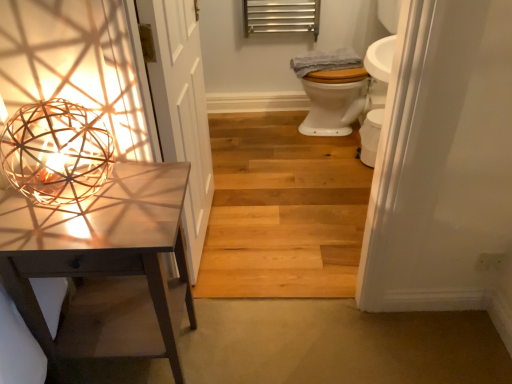
Question: Would you say woven wood sphere at left is to the left or to the right of natural wood floor at center in the picture?

Choices:
 (A) left
 (B) right

Answer: (A)

Question: In terms of width, does woven wood sphere at left look wider or thinner when compared to natural wood floor at center?

Choices:
 (A) wide
 (B) thin

Answer: (B)

Question: Which object is positioned closest to the white glossy toilet bowl at center?

Choices:
 (A) white wood door at left
 (B) metallic silver radiator at upper center
 (C) matte white table at left
 (D) woven wood sphere at left
 (E) natural wood floor at center

Answer: (E)

Question: Which object is the farthest from the woven wood sphere at left?

Choices:
 (A) metallic silver radiator at upper center
 (B) white glossy toilet bowl at center
 (C) natural wood floor at center
 (D) matte white table at left
 (E) gray cotton towel at upper right

Answer: (A)